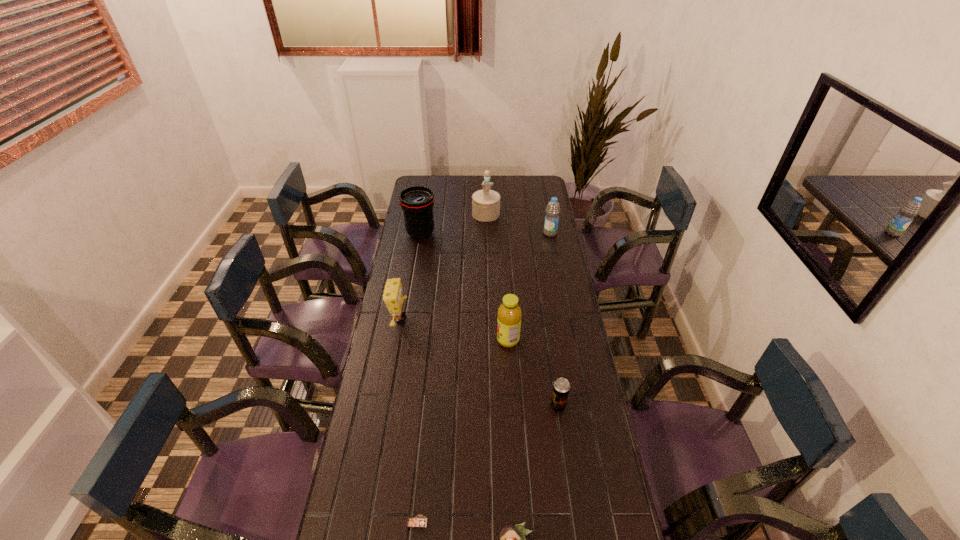
Locate an element on the screen. free space between the seventh farthest object and the figurine is located at coordinates (451, 368).

Find the location of `free spot between the second nearest object and the water bottle`. free spot between the second nearest object and the water bottle is located at coordinates (484, 377).

Identify the location of vacant area that lies between the fruit juice and the figurine. The height and width of the screenshot is (540, 960). (497, 277).

The image size is (960, 540). I want to click on empty location between the third nearest object and the fruit juice, so click(533, 373).

In order to click on unoccupied position between the rightmost object and the fourth shortest object in this screenshot , I will do `click(475, 276)`.

Locate an element on the screen. The height and width of the screenshot is (540, 960). the second closest object relative to the third object from left to right is located at coordinates (561, 387).

Select which object is the sixth closest to the sponge. Please provide its 2D coordinates. Your answer should be formatted as a tuple, i.e. [(x, y)], where the tuple contains the x and y coordinates of a point satisfying the conditions above.

[(550, 228)]

What are the coordinates of `free location that satisfies the following two spatial constraints: 1. at the beak of the sixth tallest object; 2. on the left side of the figurine` in the screenshot? It's located at (490, 406).

Locate an element on the screen. Image resolution: width=960 pixels, height=540 pixels. vacant space that satisfies the following two spatial constraints: 1. on the front label of the sixth tallest object; 2. on the right side of the fruit juice is located at coordinates (512, 406).

Locate an element on the screen. vacant point that satisfies the following two spatial constraints: 1. on the front label of the fruit juice; 2. on the front side of the seventh farthest object is located at coordinates (519, 522).